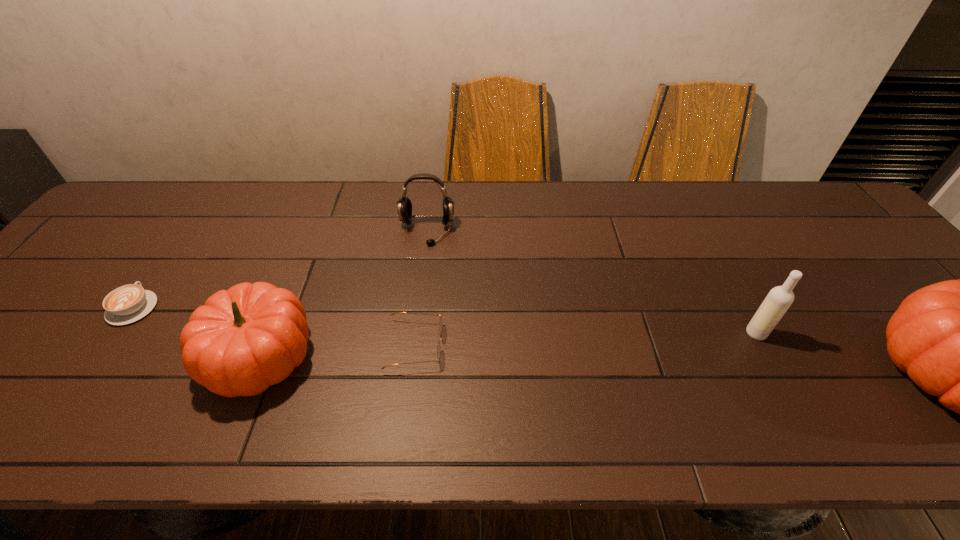
Identify the location of free spot located 0.120m on the side of the leftmost object with the handle. (169, 257).

This screenshot has height=540, width=960. Find the location of `blank space located 0.180m with the microphone on the side of the headset`. blank space located 0.180m with the microphone on the side of the headset is located at coordinates (419, 296).

Where is `vacant space situated on the temples of the spectacles`? vacant space situated on the temples of the spectacles is located at coordinates (603, 345).

You are a GUI agent. You are given a task and a screenshot of the screen. Output one action in this format:
    pyautogui.click(x=<x>, y=<y>)
    Task: Click on the blank space located on the left of the vodka
    
    Given the screenshot: What is the action you would take?
    pyautogui.click(x=651, y=333)

Find the location of a particular element. object positioned at the far edge is located at coordinates (404, 203).

Find the location of a particular element. pumpkin at the near edge is located at coordinates (244, 339).

In order to click on spectacles positioned at the near edge in this screenshot , I will do `click(441, 323)`.

Where is `free spot at the far edge of the desktop`? Image resolution: width=960 pixels, height=540 pixels. free spot at the far edge of the desktop is located at coordinates point(476,190).

Find the location of `vacant region at the near edge of the desktop`. vacant region at the near edge of the desktop is located at coordinates (320, 400).

Image resolution: width=960 pixels, height=540 pixels. Identify the location of free region at the left edge. (62, 269).